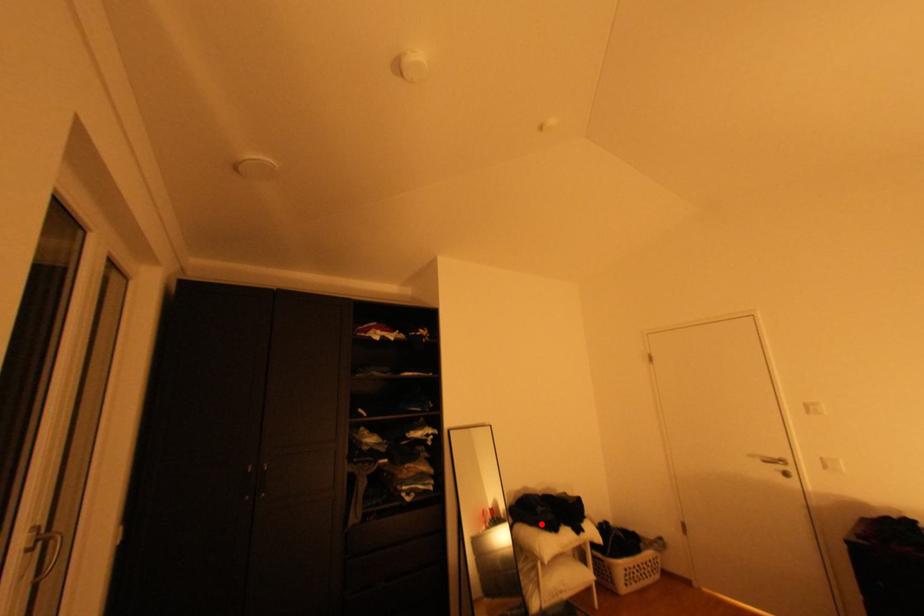
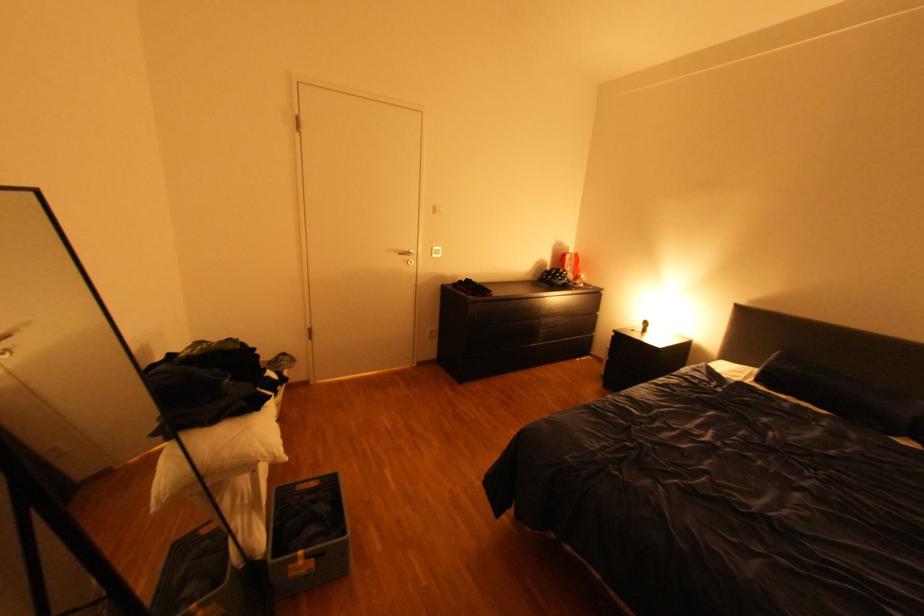
Locate, in the second image, the point that corresponds to the highlighted location in the first image.

(223, 421)